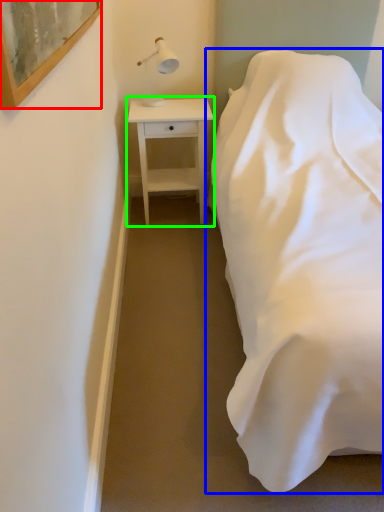
Question: Based on their relative distances, which object is nearer to picture frame (highlighted by a red box)? Choose from bed (highlighted by a blue box) and nightstand (highlighted by a green box).

Choices:
 (A) bed
 (B) nightstand

Answer: (A)